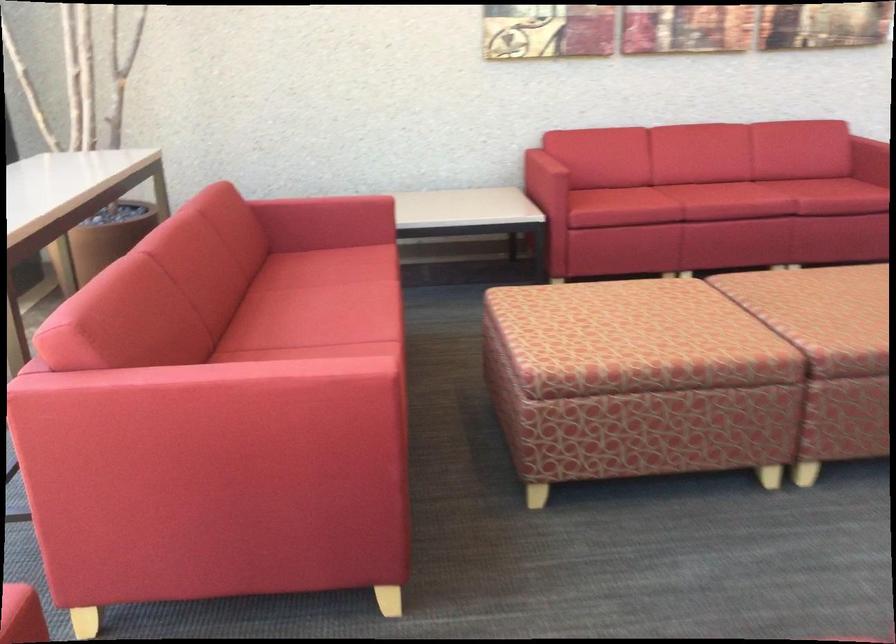
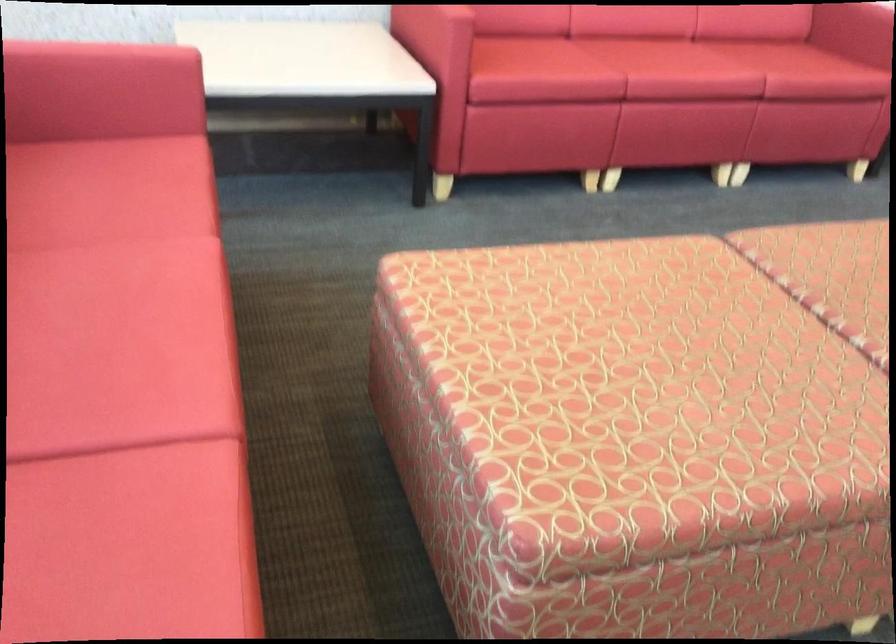
Locate, in the second image, the point that corresponds to point (340, 196) in the first image.

(102, 53)